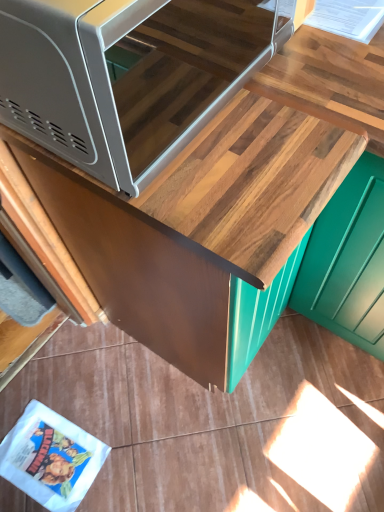
Image resolution: width=384 pixels, height=512 pixels. In order to click on unoccupied area in front of wooden cabinet at upper center in this screenshot , I will do (189, 445).